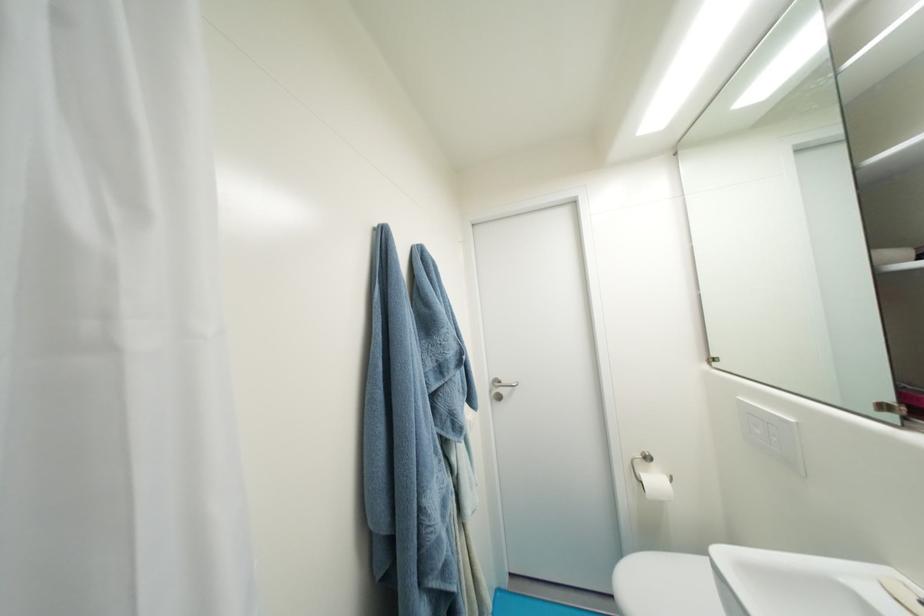
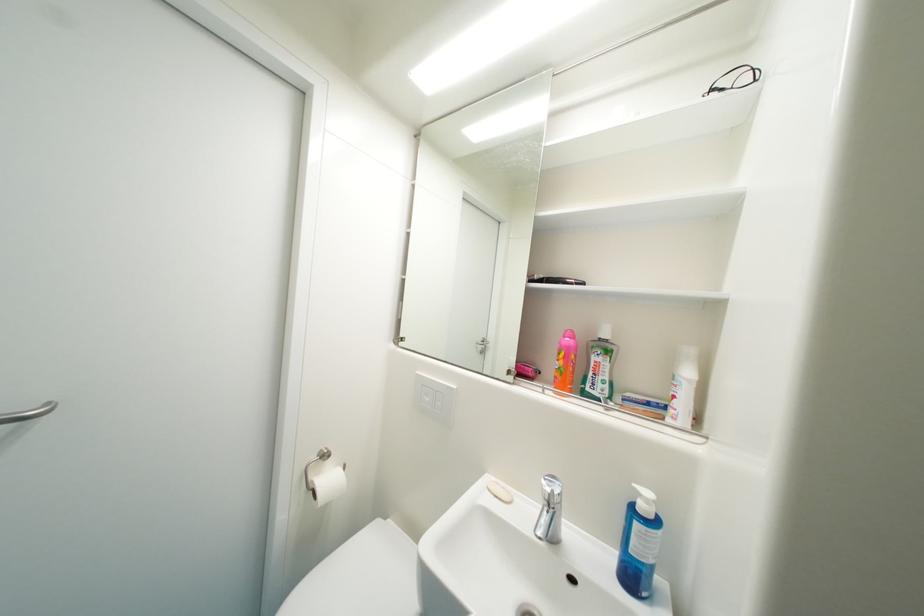
The point at (764, 434) is marked in the first image. Where is the corresponding point in the second image?

(433, 400)